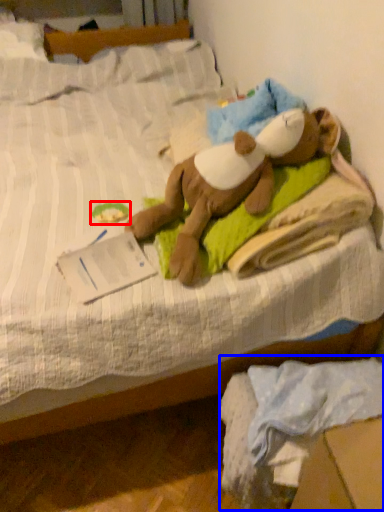
Question: Which object appears farthest to the camera in this image, toy (highlighted by a red box) or material (highlighted by a blue box)?

Choices:
 (A) toy
 (B) material

Answer: (A)